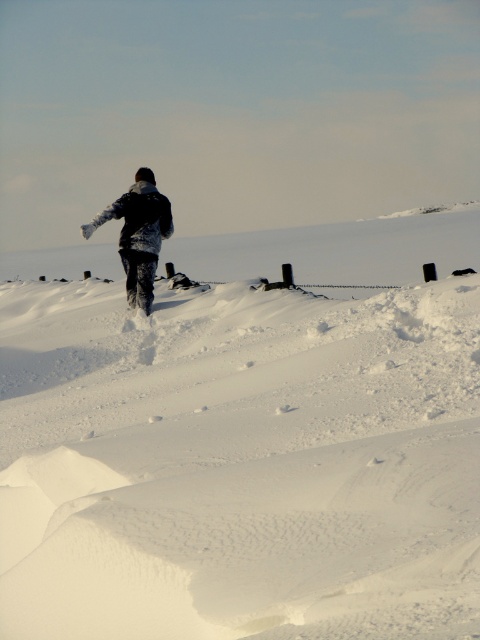
You are standing at the origin point of the coordinate system in the winter scene. The person is walking towards the horizon. Where is the white fluffy snow at center located in relation to your position?

The white fluffy snow at center is located at coordinates point (x=243, y=440).